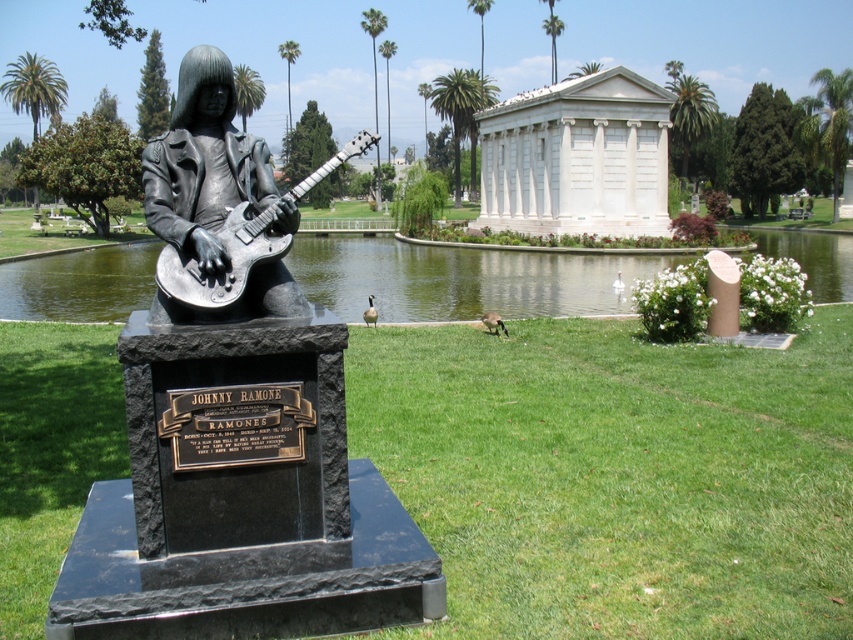
The image size is (853, 640). What do you see at coordinates (241, 486) in the screenshot?
I see `polished bronze statue at left` at bounding box center [241, 486].

Who is more distant from viewer, (204, 312) or (265, 250)?

The point (265, 250) is more distant.

What are the coordinates of `polished bronze statue at left` in the screenshot? It's located at (241, 486).

Between polished silver guitar at center and shiny metallic guitar at center, which one has more height?

shiny metallic guitar at center

Who is positioned more to the right, polished silver guitar at center or shiny metallic guitar at center?

Positioned to the right is shiny metallic guitar at center.

Describe the element at coordinates (202, 163) in the screenshot. I see `polished silver guitar at center` at that location.

Identify the location of polished silver guitar at center. (202, 163).

Based on the photo, does polished bronze statue at left have a greater height compared to green water at center?

Incorrect, polished bronze statue at left's height is not larger of green water at center's.

In order to click on polished bronze statue at left in this screenshot , I will do `click(241, 486)`.

The image size is (853, 640). What are the coordinates of `polished bronze statue at left` in the screenshot? It's located at (241, 486).